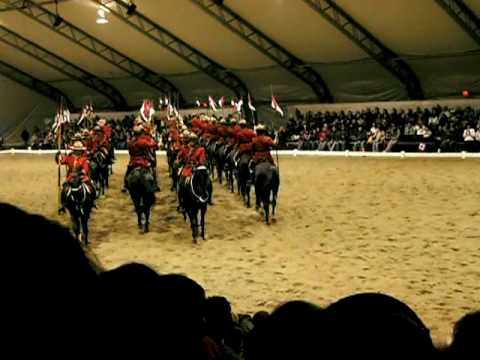
I want to click on ceiling, so tap(273, 23).